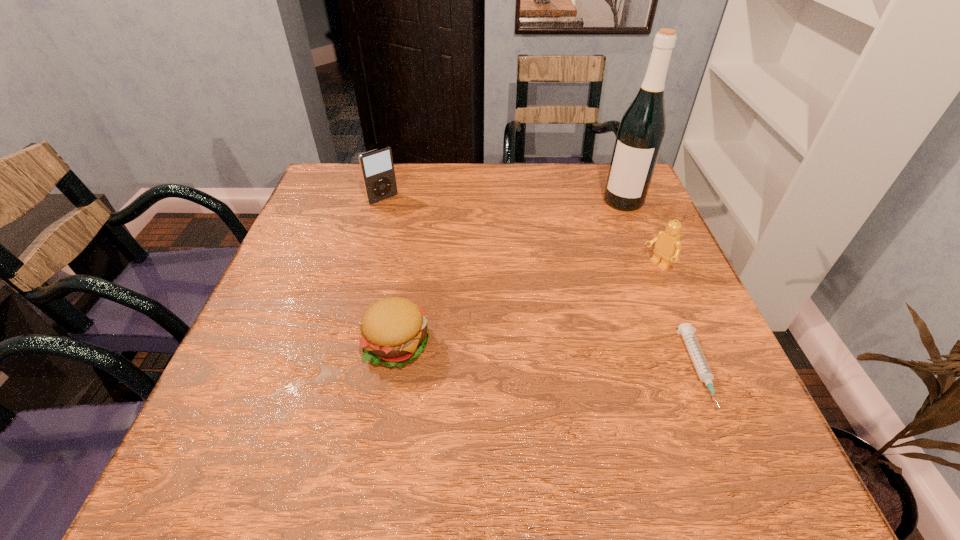
The width and height of the screenshot is (960, 540). Find the location of `vacant region at the near left corner of the desktop`. vacant region at the near left corner of the desktop is located at coordinates (290, 390).

Find the location of a particular element. This screenshot has height=540, width=960. free region at the far right corner of the desktop is located at coordinates (608, 172).

Where is `unoccupied position between the syringe and the fourth shortest object`? This screenshot has width=960, height=540. unoccupied position between the syringe and the fourth shortest object is located at coordinates (540, 285).

Locate an element on the screen. The image size is (960, 540). empty space between the fourth shortest object and the hamburger is located at coordinates (390, 272).

Where is `empty space that is in between the wine bottle and the shortest object`? Image resolution: width=960 pixels, height=540 pixels. empty space that is in between the wine bottle and the shortest object is located at coordinates (661, 285).

The image size is (960, 540). I want to click on empty space between the third shortest object and the second shortest object, so click(526, 305).

I want to click on free space between the second shortest object and the third shortest object, so click(526, 305).

Locate an element on the screen. This screenshot has height=540, width=960. blank region between the second tallest object and the syringe is located at coordinates (540, 285).

Image resolution: width=960 pixels, height=540 pixels. Find the location of `unoccupied position between the wine bottle and the second shortest object`. unoccupied position between the wine bottle and the second shortest object is located at coordinates (510, 273).

At what (x,y) coordinates should I click in order to perform the action: click on empty space between the shortest object and the fourth tallest object. Please return your answer as a coordinate pair (x, y). The image size is (960, 540). Looking at the image, I should click on (547, 357).